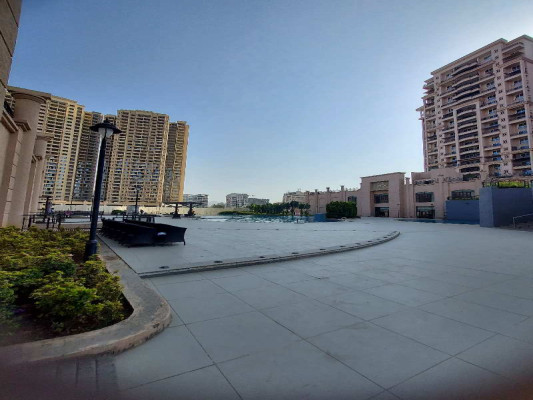
I want to click on concrete floor, so click(318, 282).